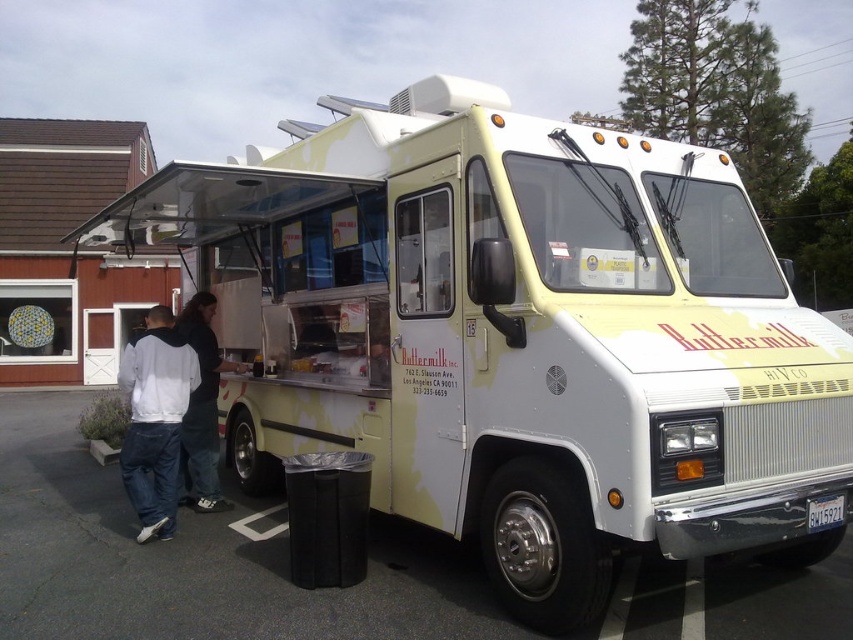
You are a customer waiting in line at the food truck. You notice two people ahead of you wearing white. Which of the two, the white hoodie at left or the white cotton shirt at left, is positioned lower on their body?

The white hoodie at left is located below the white cotton shirt at left, meaning the hoodie is lower on the body compared to the shirt.